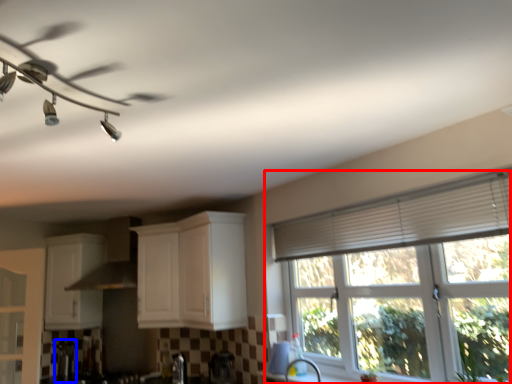
Question: Which point is closer to the camera, window (highlighted by a red box) or appliance (highlighted by a blue box)?

Choices:
 (A) window
 (B) appliance

Answer: (A)